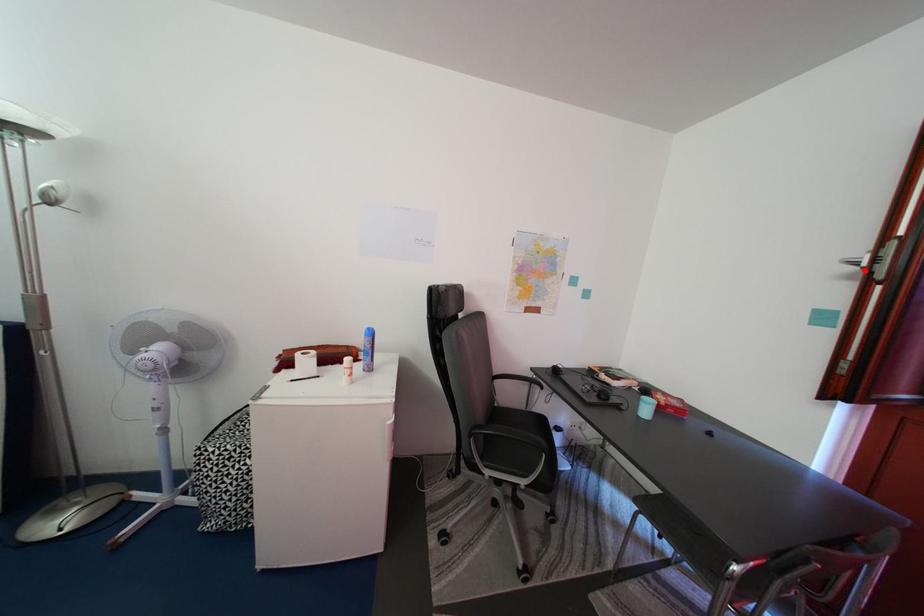
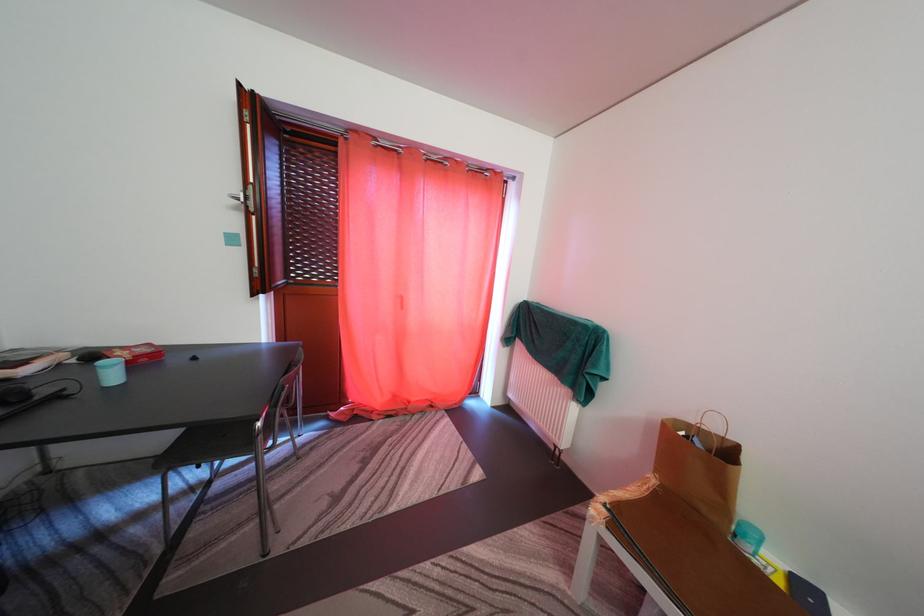
Find the pixel in the second image that matches the highlighted location in the first image.

(247, 206)